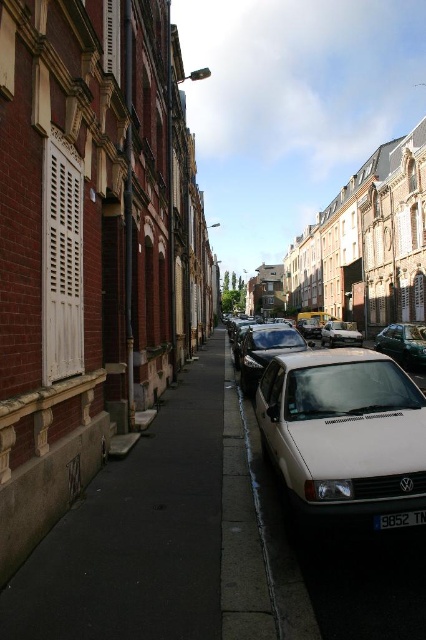
Between white matte car at center and silver metallic van at center, which one has more height?

white matte car at center

Does white matte car at center appear on the left side of silver metallic van at center?

Indeed, white matte car at center is positioned on the left side of silver metallic van at center.

Describe the element at coordinates (344, 433) in the screenshot. I see `white matte car at center` at that location.

Image resolution: width=426 pixels, height=640 pixels. In order to click on white matte car at center in this screenshot , I will do `click(344, 433)`.

Is white matte car at center to the left of shiny silver car at center from the viewer's perspective?

Indeed, white matte car at center is positioned on the left side of shiny silver car at center.

Which is in front, point (336, 483) or point (252, 340)?

Point (336, 483)

Between point (276, 369) and point (247, 380), which one is positioned in front?

Point (276, 369) is in front.

You are a GUI agent. You are given a task and a screenshot of the screen. Output one action in this format:
    pyautogui.click(x=<x>, y=<y>)
    Task: Click on the white matte car at center
    The width and height of the screenshot is (426, 640).
    Given the screenshot: What is the action you would take?
    pyautogui.click(x=344, y=433)

Can you confirm if shiny silver car at center is shorter than black plastic license plate at center?

No, shiny silver car at center is not shorter than black plastic license plate at center.

Between shiny silver car at center and black plastic license plate at center, which one is positioned higher?

shiny silver car at center

Who is more forward, [281,348] or [403,520]?

Point [403,520]

This screenshot has width=426, height=640. I want to click on shiny silver car at center, so click(264, 352).